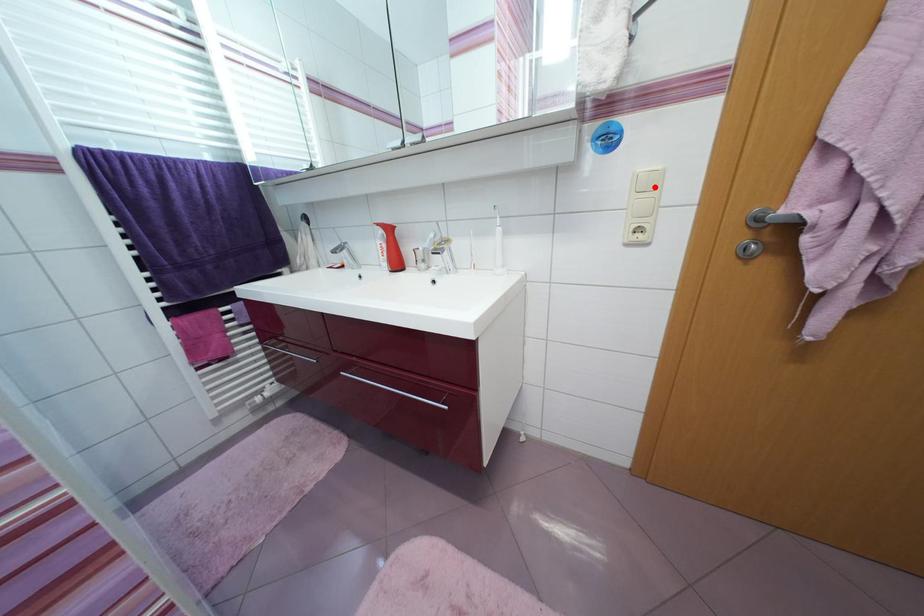
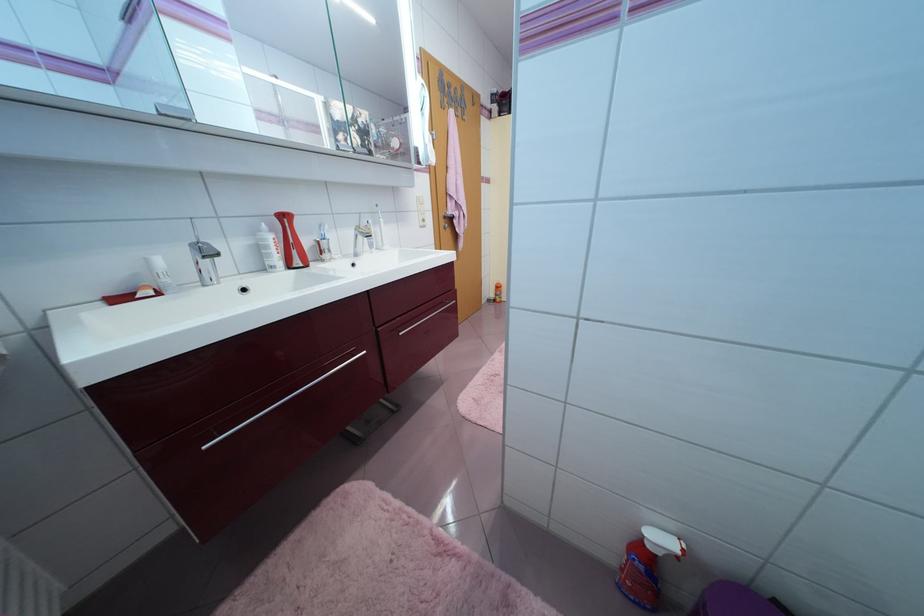
Question: I am providing you with two images of the same scene from different viewpoints. A red point is marked on the first image. At the location where the point appears in image 1, is it still visible in image 2?

Choices:
 (A) Yes
 (B) No

Answer: (B)